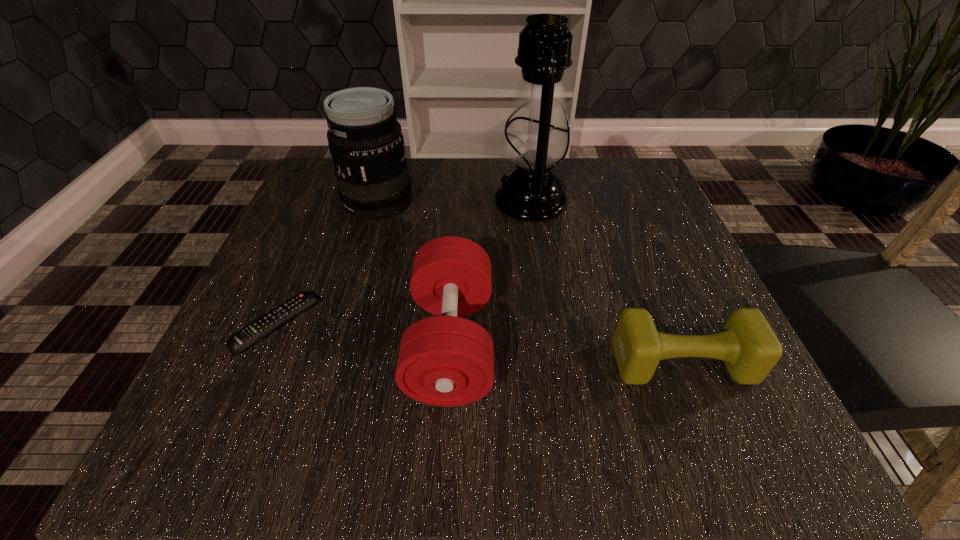
Find the location of a particular element. This screenshot has height=540, width=960. the second object from right to left is located at coordinates (536, 140).

Identify the location of oil lamp. (536, 140).

The image size is (960, 540). Find the location of `telephoto lens`. telephoto lens is located at coordinates (365, 140).

In order to click on the third object from left to right in this screenshot , I will do `click(445, 360)`.

Where is `the left dumbbell`? The height and width of the screenshot is (540, 960). the left dumbbell is located at coordinates (445, 360).

Where is `the rightmost object`? The height and width of the screenshot is (540, 960). the rightmost object is located at coordinates (747, 345).

You are a GUI agent. You are given a task and a screenshot of the screen. Output one action in this format:
    pyautogui.click(x=<x>, y=<y>)
    Task: Click on the right dumbbell
    Image resolution: width=960 pixels, height=540 pixels.
    Given the screenshot: What is the action you would take?
    pyautogui.click(x=747, y=345)

Locate an element on the screen. This screenshot has width=960, height=540. remote control is located at coordinates (255, 331).

Locate an element on the screen. The width and height of the screenshot is (960, 540). vacant area located on the left of the tallest object is located at coordinates (380, 201).

The width and height of the screenshot is (960, 540). Identify the location of vacant space positioned 0.130m on the front of the telephoto lens. (359, 268).